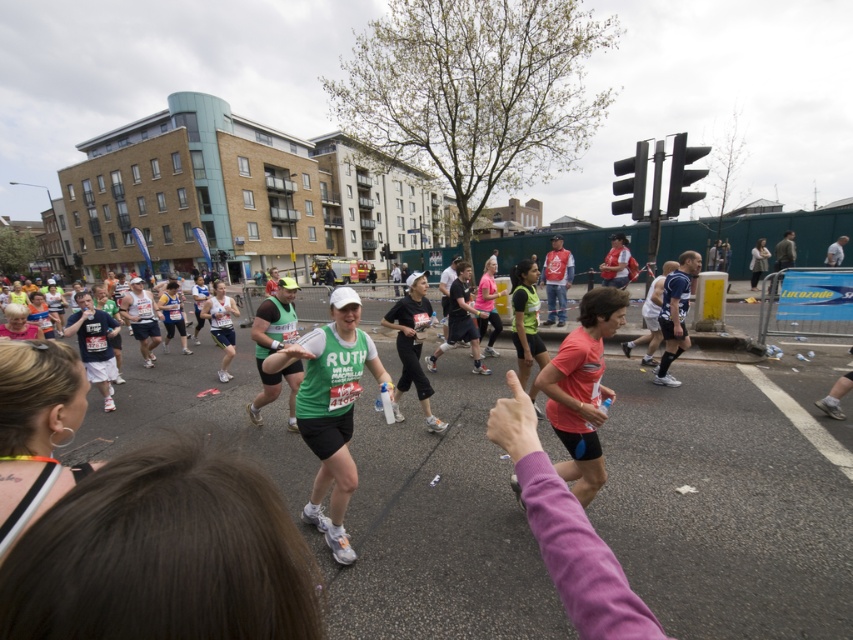
Is matte pink shirt at center to the right of pink fabric shirt at center from the viewer's perspective?

Correct, you'll find matte pink shirt at center to the right of pink fabric shirt at center.

Is matte pink shirt at center thinner than pink fabric shirt at center?

No, matte pink shirt at center is not thinner than pink fabric shirt at center.

You are a GUI agent. You are given a task and a screenshot of the screen. Output one action in this format:
    pyautogui.click(x=<x>, y=<y>)
    Task: Click on the matte pink shirt at center
    
    Given the screenshot: What is the action you would take?
    582,388

Does green fabric shirt at center appear on the right side of pink fabric shirt at center?

Yes, green fabric shirt at center is to the right of pink fabric shirt at center.

Is green fabric shirt at center taller than pink fabric shirt at center?

No, green fabric shirt at center is not taller than pink fabric shirt at center.

I want to click on green fabric shirt at center, so (x=526, y=320).

Does green matte shirt at center appear under green fabric shirt at center?

Correct, green matte shirt at center is located below green fabric shirt at center.

Is green matte shirt at center to the left of green fabric shirt at center from the viewer's perspective?

Yes, green matte shirt at center is to the left of green fabric shirt at center.

In order to click on green matte shirt at center in this screenshot , I will do `click(331, 408)`.